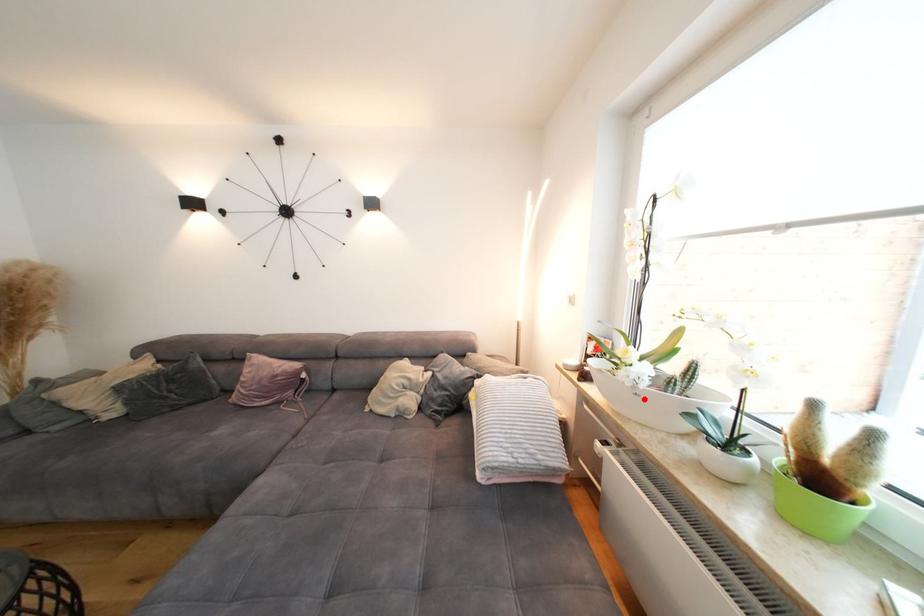
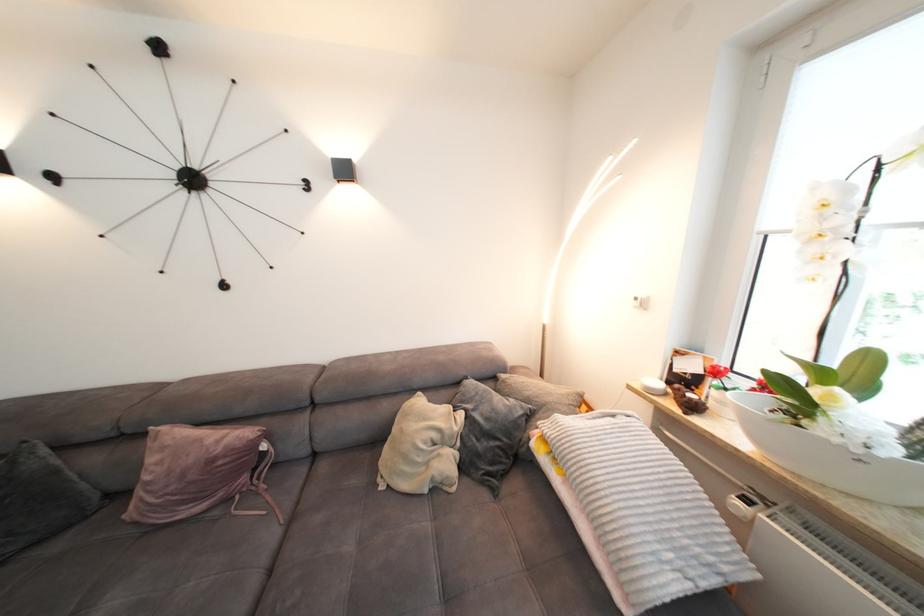
Locate, in the second image, the point that corresponds to the highlighted location in the first image.

(869, 467)